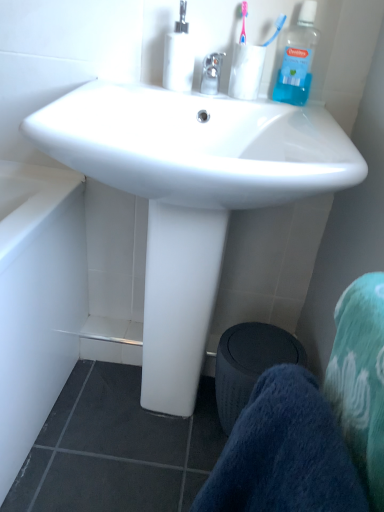
You are a GUI agent. You are given a task and a screenshot of the screen. Output one action in this format:
    pyautogui.click(x=<x>, y=<y>)
    Task: Click on the blank space to the left of transparent plastic soap dispenser at upper center, the second bottle from the right
    
    Given the screenshot: What is the action you would take?
    pyautogui.click(x=114, y=84)